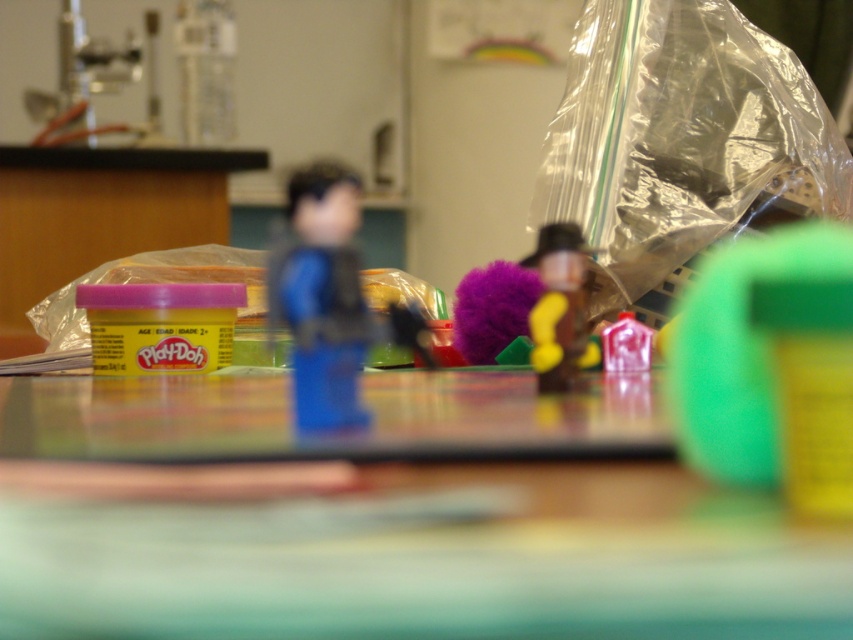
Question: Which point is farther from the camera taking this photo?

Choices:
 (A) (637, 371)
 (B) (560, 294)
 (C) (744, 522)
 (D) (299, 376)

Answer: (A)

Question: Does transparent plastic bag at right appear under pink matte play-doh at center?

Choices:
 (A) no
 (B) yes

Answer: (A)

Question: From the image, what is the correct spatial relationship of blue plastic figure at center in relation to smooth brown figurine at center?

Choices:
 (A) below
 (B) above

Answer: (B)

Question: Among these points, which one is farthest from the camera?

Choices:
 (A) (625, 236)
 (B) (312, 557)

Answer: (A)

Question: Which point is closer to the camera?

Choices:
 (A) (556, 388)
 (B) (309, 547)

Answer: (B)

Question: Is transparent plastic bag at right above smooth brown figurine at center?

Choices:
 (A) no
 (B) yes

Answer: (B)